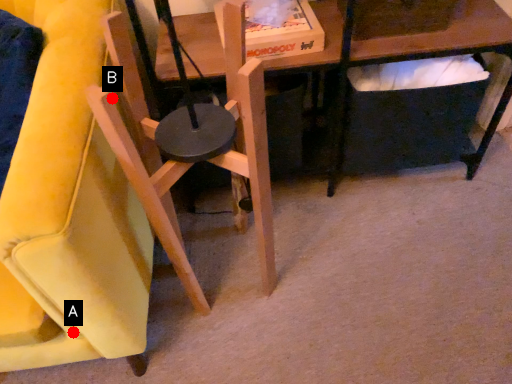
Question: Two points are circled on the image, labeled by A and B beside each circle. Which point is closer to the camera?

Choices:
 (A) A is closer
 (B) B is closer

Answer: (B)